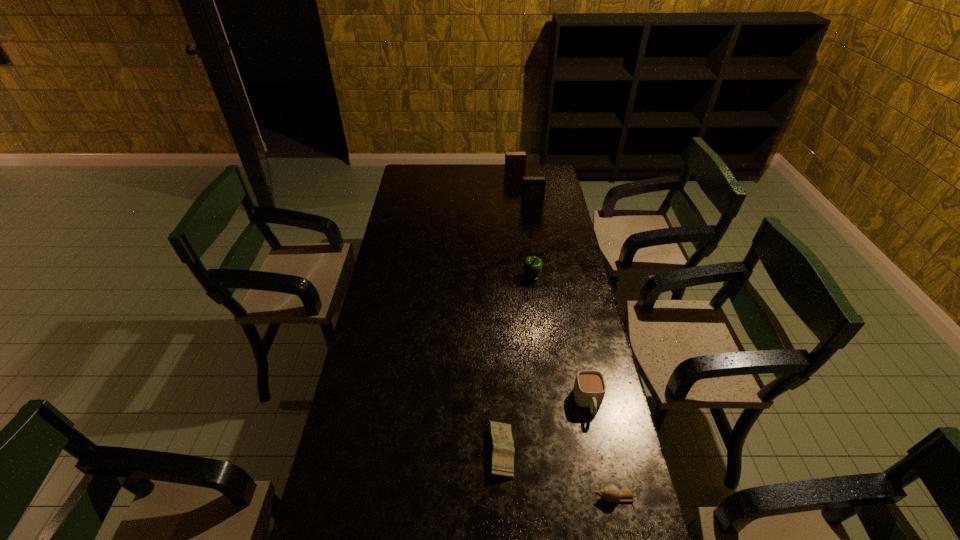
Identify the location of vacant space in between the fourth nearest object and the farthest object. (523, 227).

Locate an element on the screen. Image resolution: width=960 pixels, height=540 pixels. free space that is in between the nearest object and the farthest object is located at coordinates (565, 336).

Find the location of a particular element. The image size is (960, 540). vacant region between the fourth tallest object and the escargot is located at coordinates (602, 450).

Identify the location of blank region between the leftmost object and the nearest object. (559, 474).

Locate an element on the screen. The image size is (960, 540). free space between the fourth nearest object and the third nearest object is located at coordinates (560, 340).

This screenshot has width=960, height=540. Find the location of `vacant area between the third farthest object and the second nearest object`. vacant area between the third farthest object and the second nearest object is located at coordinates (516, 364).

What are the coordinates of `the fifth closest object to the leftmost object` in the screenshot? It's located at (515, 161).

Point out which object is positioned as the third nearest to the nearest object. Please provide its 2D coordinates. Your answer should be formatted as a tuple, i.e. [(x, y)], where the tuple contains the x and y coordinates of a point satisfying the conditions above.

[(532, 265)]

You are a GUI agent. You are given a task and a screenshot of the screen. Output one action in this format:
    pyautogui.click(x=<x>, y=<y>)
    Task: Click on the diary that is the second closest to the nearest diary
    This screenshot has height=540, width=960.
    Given the screenshot: What is the action you would take?
    pyautogui.click(x=515, y=161)

Locate which diary is the closest to the second nearest diary. Please provide its 2D coordinates. Your answer should be formatted as a tuple, i.e. [(x, y)], where the tuple contains the x and y coordinates of a point satisfying the conditions above.

[(515, 161)]